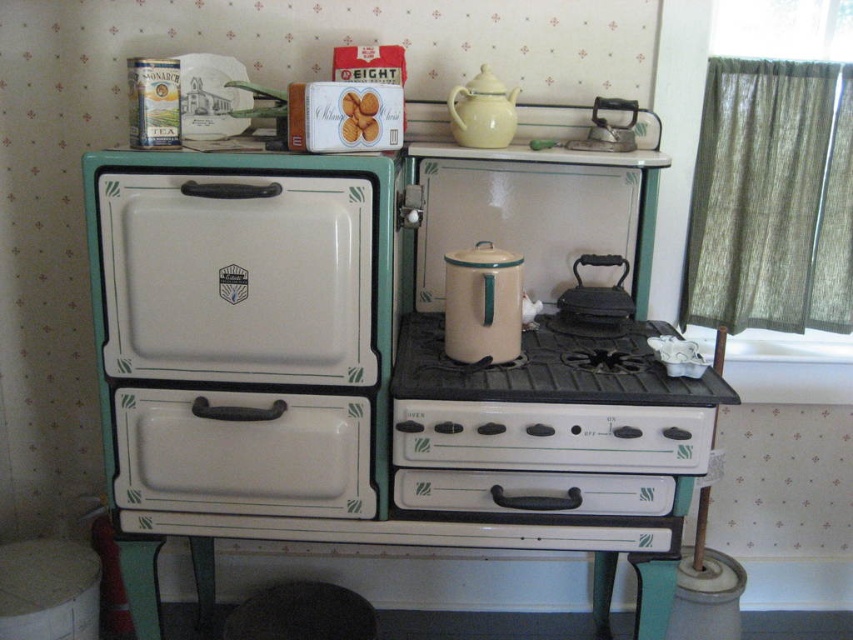
Question: Which of the following is the farthest from the observer?

Choices:
 (A) (490, 260)
 (B) (274, 588)

Answer: (B)

Question: Is white enamel gas stove at center to the right of black rubber stool at lower center from the viewer's perspective?

Choices:
 (A) no
 (B) yes

Answer: (B)

Question: Does white enameled cabinet at center appear on the left side of white enamel gas stove at center?

Choices:
 (A) yes
 (B) no

Answer: (A)

Question: Based on their relative distances, which object is nearer to the beige enamel canister at center?

Choices:
 (A) white enameled cabinet at center
 (B) black cast iron griddle at center
 (C) white enamel gas stove at center
 (D) black rubber stool at lower center

Answer: (C)

Question: Among these points, which one is farthest from the camera?

Choices:
 (A) pyautogui.click(x=248, y=396)
 (B) pyautogui.click(x=511, y=253)
 (C) pyautogui.click(x=392, y=408)
 (D) pyautogui.click(x=625, y=316)

Answer: (D)

Question: In this image, where is white enameled cabinet at center located relative to beige enamel canister at center?

Choices:
 (A) left
 (B) right

Answer: (A)